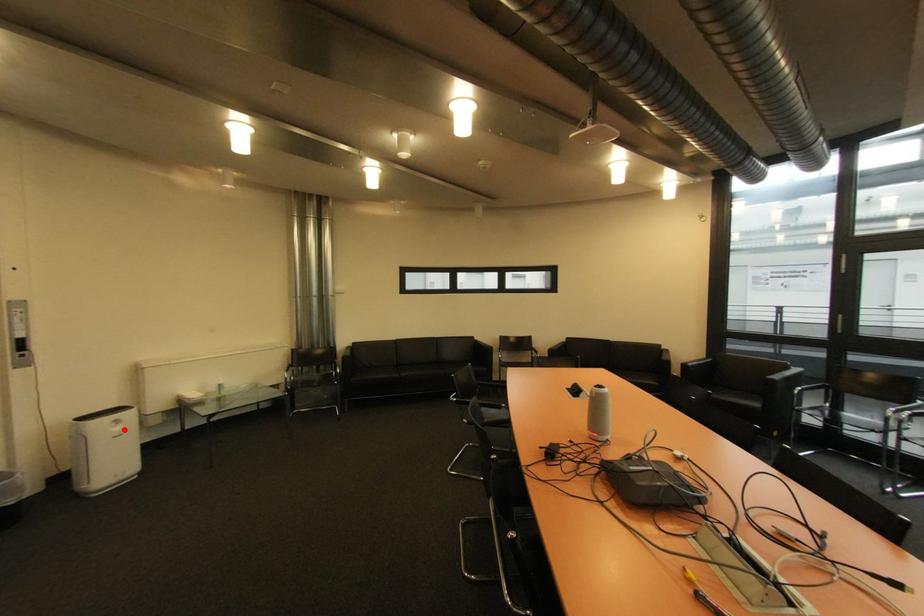
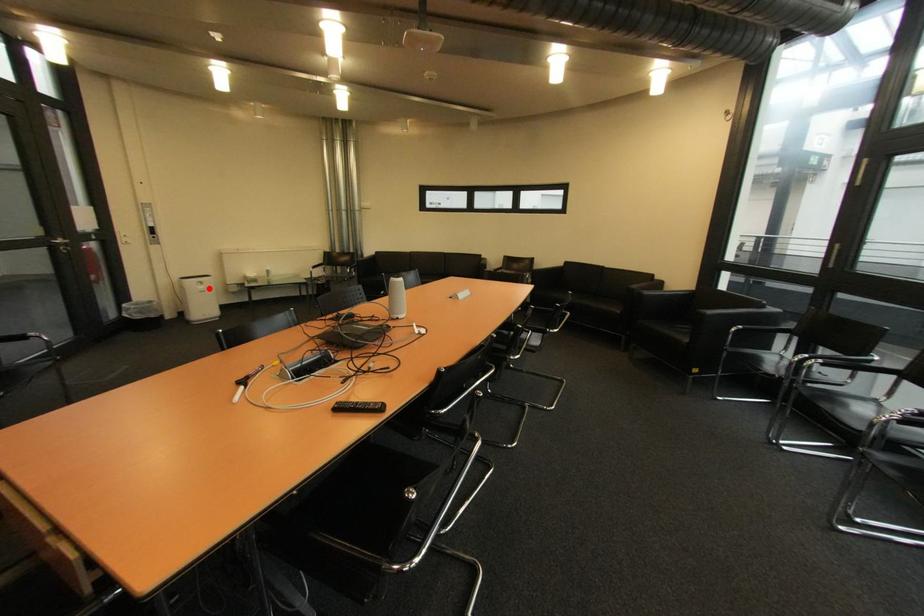
I am providing you with two images of the same scene from different viewpoints. A red point is marked on the first image and another point is marked on the second image. Does the point marked in image1 correspond to the same location as the one in image2?

Yes